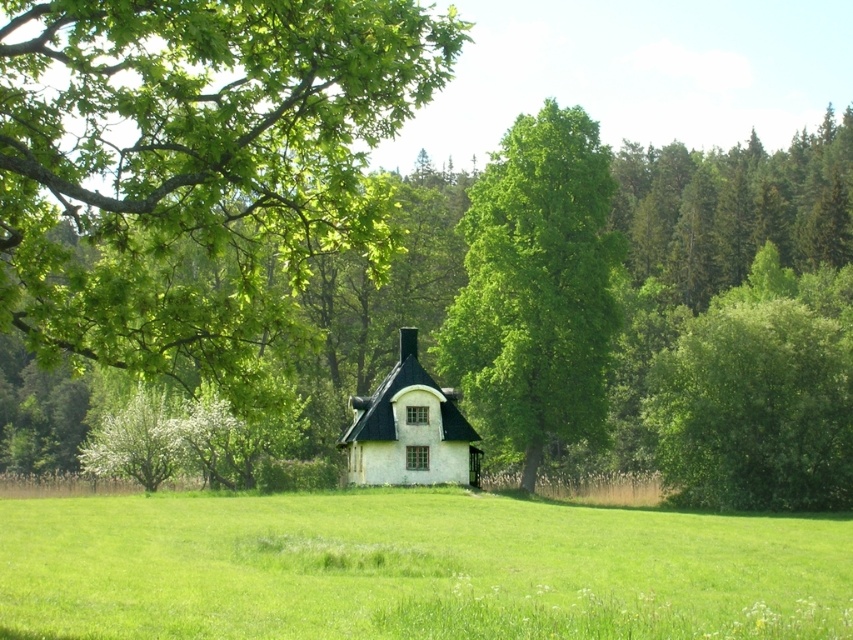
Based on the photo, who is higher up, green grassy field at center or green leafy tree at center?

green leafy tree at center is higher up.

Which is in front, point (18, 611) or point (495, 176)?

Positioned in front is point (18, 611).

The height and width of the screenshot is (640, 853). In order to click on green grassy field at center in this screenshot , I will do `click(412, 568)`.

Who is positioned more to the right, green leafy tree at center or white matte cottage at center?

Positioned to the right is green leafy tree at center.

Does green leafy tree at center have a larger size compared to white matte cottage at center?

Yes.

Which is in front, point (541, 433) or point (392, 413)?

Point (392, 413) is more forward.

Where is `green leafy tree at center`? The width and height of the screenshot is (853, 640). green leafy tree at center is located at coordinates (537, 285).

Can you confirm if green grassy field at center is smaller than white matte cottage at center?

No.

Does point (813, 522) lie in front of point (396, 401)?

Yes, point (813, 522) is in front of point (396, 401).

Describe the element at coordinates (412, 568) in the screenshot. I see `green grassy field at center` at that location.

Where is `green grassy field at center`? The image size is (853, 640). green grassy field at center is located at coordinates (412, 568).